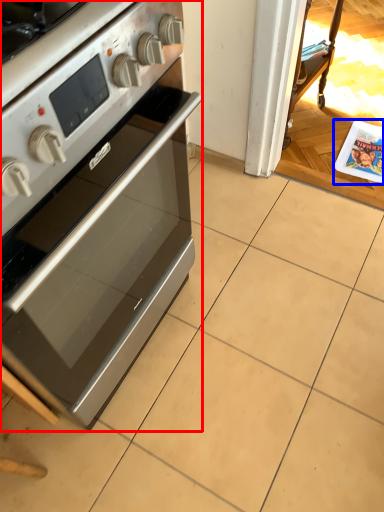
Question: Which object is further to the camera taking this photo, home appliance (highlighted by a red box) or magazine (highlighted by a blue box)?

Choices:
 (A) home appliance
 (B) magazine

Answer: (B)